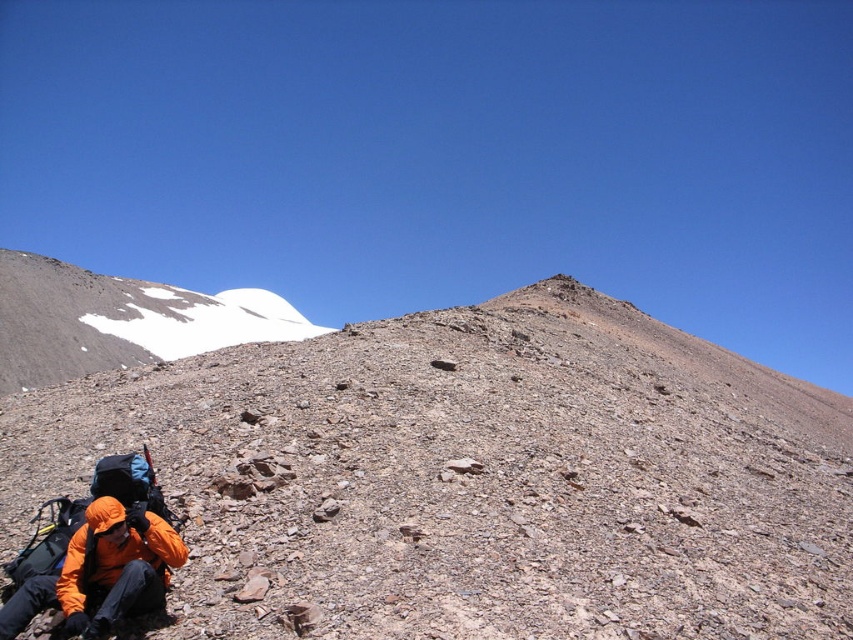
Question: Which point appears closest to the camera in this image?

Choices:
 (A) click(152, 291)
 (B) click(154, 600)
 (C) click(628, 465)

Answer: (B)

Question: Which is farther from the orange fleece jacket at lower left?

Choices:
 (A) brown rocky mountain at lower left
 (B) white snow-covered mountain at upper left

Answer: (B)

Question: Estimate the real-world distances between objects in this image. Which object is closer to the brown rocky mountain at lower left?

Choices:
 (A) white snow-covered mountain at upper left
 (B) orange fleece jacket at lower left

Answer: (B)

Question: Is white snow-covered mountain at upper left below orange fleece jacket at lower left?

Choices:
 (A) no
 (B) yes

Answer: (A)

Question: Does white snow-covered mountain at upper left have a larger size compared to orange fleece jacket at lower left?

Choices:
 (A) no
 (B) yes

Answer: (B)

Question: Does brown rocky mountain at lower left have a greater width compared to white snow-covered mountain at upper left?

Choices:
 (A) no
 (B) yes

Answer: (A)